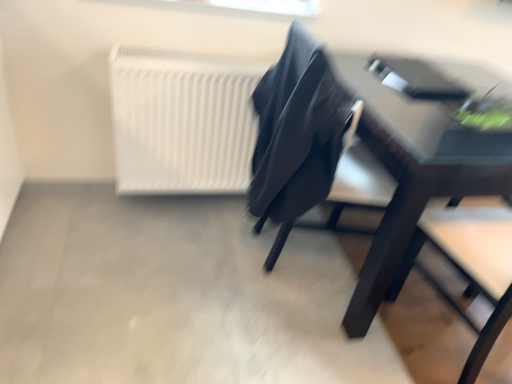
What are the coordinates of `matte black table at right` in the screenshot? It's located at (414, 169).

This screenshot has width=512, height=384. I want to click on matte black chair at center, so click(297, 135).

From a real-world perspective, is matte black table at right over white matte radiator at upper left?

No.

Is matte black table at right surrounding white matte radiator at upper left?

No, white matte radiator at upper left is not a part of matte black table at right.

This screenshot has width=512, height=384. Identify the location of table located on the right of white matte radiator at upper left. (414, 169).

Considering the sizes of objects matte black table at right and white matte radiator at upper left in the image provided, who is taller, matte black table at right or white matte radiator at upper left?

Standing taller between the two is matte black table at right.

From the image's perspective, between white matte radiator at upper left and matte black chair at center, which one is located above?

white matte radiator at upper left appears higher in the image.

From a real-world perspective, who is located lower, white matte radiator at upper left or matte black chair at center?

In real-world perspective, white matte radiator at upper left is lower.

Locate an element on the screen. The image size is (512, 384). radiator located underneath the matte black chair at center (from a real-world perspective) is located at coordinates (182, 121).

Where is `table below the matte black chair at center (from the image's perspective)`? This screenshot has width=512, height=384. table below the matte black chair at center (from the image's perspective) is located at coordinates (414, 169).

Between matte black chair at center and matte black table at right, which one appears on the left side from the viewer's perspective?

From the viewer's perspective, matte black chair at center appears more on the left side.

Would you say matte black chair at center is inside or outside matte black table at right?

matte black chair at center exists outside the volume of matte black table at right.

From the image's perspective, which one is positioned higher, matte black table at right or matte black chair at center?

matte black chair at center, from the image's perspective.

Based on the photo, does matte black table at right have a greater height compared to matte black chair at center?

Yes.

Is matte black table at right positioned far away from matte black chair at center?

That's not correct — matte black table at right is a little close to matte black chair at center.

Is point (435, 159) in front of point (345, 124)?

Yes, point (435, 159) is closer to viewer.

From the image's perspective, between white matte radiator at upper left and matte black table at right, who is located below?

matte black table at right appears lower in the image.

How many degrees apart are the facing directions of white matte radiator at upper left and matte black table at right?

white matte radiator at upper left and matte black table at right are facing 0.574 degrees away from each other.

In the scene shown: Considering the sizes of objects white matte radiator at upper left and matte black table at right in the image provided, who is smaller, white matte radiator at upper left or matte black table at right?

white matte radiator at upper left.

Considering the positions of points (128, 132) and (370, 146), is point (128, 132) closer to camera compared to point (370, 146)?

That is False.

Considering the relative sizes of matte black chair at center and white matte radiator at upper left in the image provided, is matte black chair at center bigger than white matte radiator at upper left?

Yes.

Is matte black chair at center beside white matte radiator at upper left?

matte black chair at center and white matte radiator at upper left are clearly separated.

In the scene shown: From a real-world perspective, which object rests below the other?

white matte radiator at upper left is physically lower.

At what (x,y) coordinates should I click in order to perform the action: click on table in front of the white matte radiator at upper left. Please return your answer as a coordinate pair (x, y). This screenshot has width=512, height=384. Looking at the image, I should click on (414, 169).

Locate an element on the screen. radiator located underneath the matte black chair at center (from a real-world perspective) is located at coordinates (182, 121).

From the picture: Estimate the real-world distances between objects in this image. Which object is further from white matte radiator at upper left, matte black chair at center or matte black table at right?

The object further to white matte radiator at upper left is matte black table at right.

Based on their spatial positions, is white matte radiator at upper left or matte black table at right further from matte black chair at center?

Among the two, white matte radiator at upper left is located further to matte black chair at center.

When comparing their distances from white matte radiator at upper left, does matte black table at right or matte black chair at center seem further?

Among the two, matte black table at right is located further to white matte radiator at upper left.

From the picture: From the image, which object appears to be nearer to matte black table at right, white matte radiator at upper left or matte black chair at center?

matte black chair at center is closer to matte black table at right.

Estimate the real-world distances between objects in this image. Which object is further from matte black chair at center, matte black table at right or white matte radiator at upper left?

Among the two, white matte radiator at upper left is located further to matte black chair at center.

Considering their positions, is matte black chair at center positioned closer to matte black table at right than white matte radiator at upper left?

matte black chair at center is positioned closer to the anchor matte black table at right.

The image size is (512, 384). Identify the location of chair between white matte radiator at upper left and matte black table at right from left to right. (297, 135).